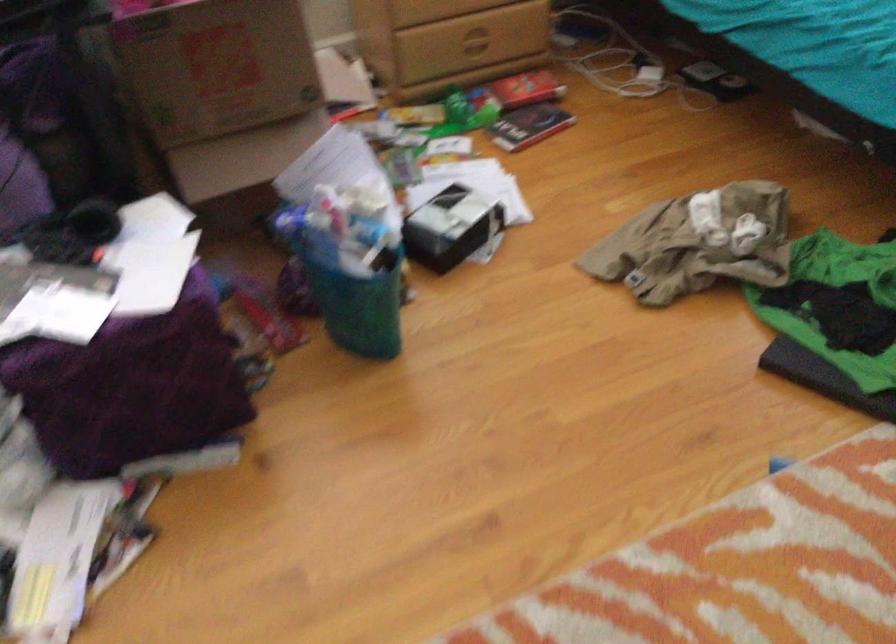
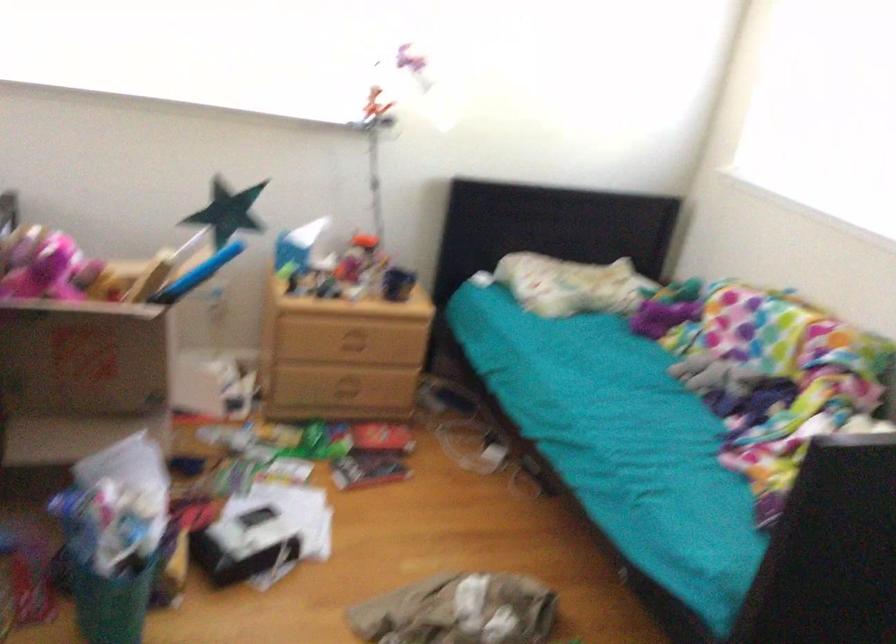
Which direction would the cameraman need to move to produce the second image?

The cameraman moved toward right, backward.